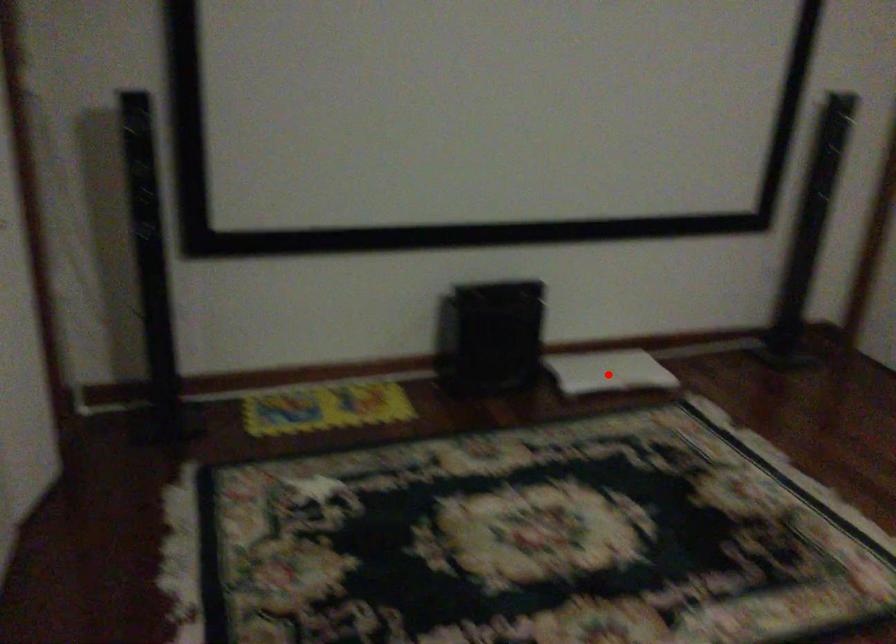
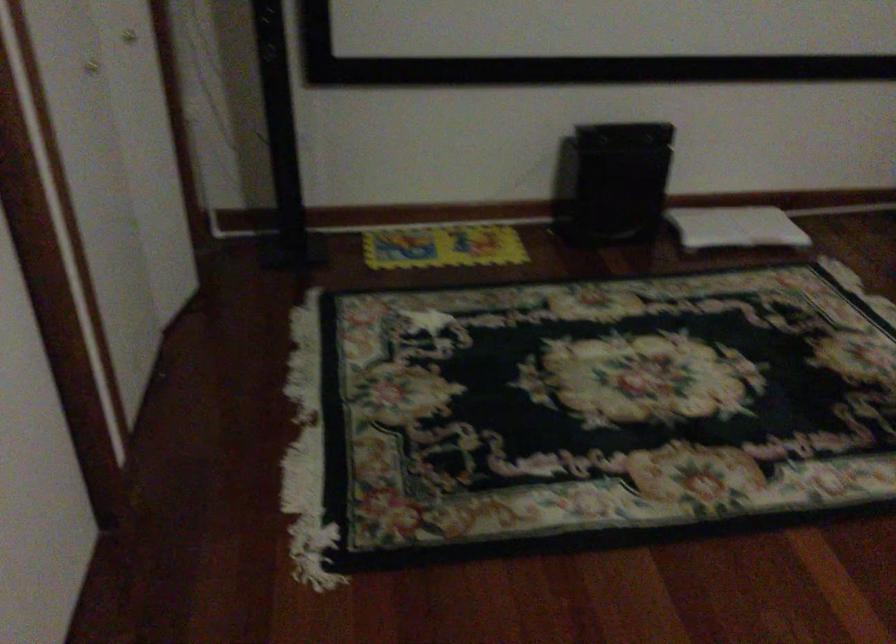
The point at the highlighted location is marked in the first image. Where is the corresponding point in the second image?

(735, 227)